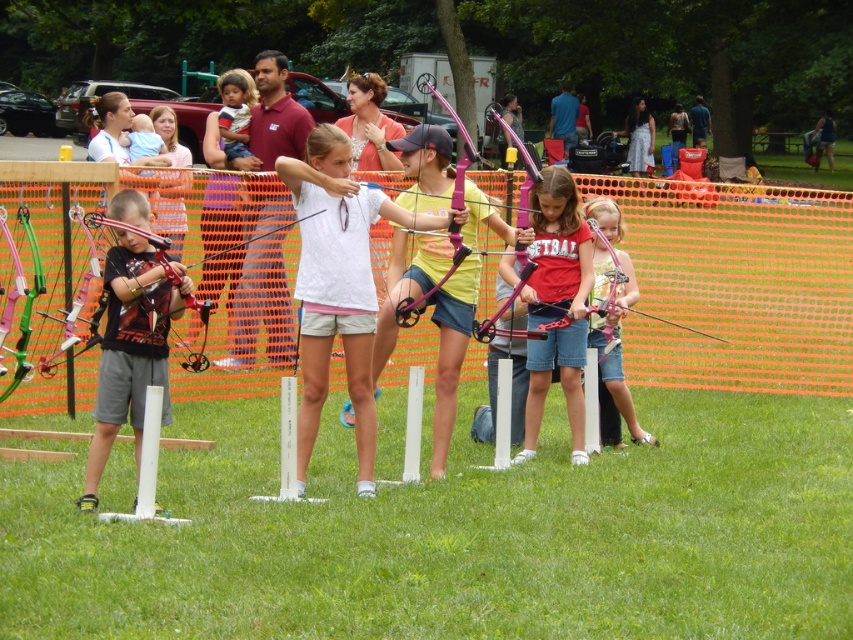
Between point (570, 324) and point (651, 134), which one is positioned behind?

The point (651, 134) is behind.

Which is more to the right, matte red bow at center or matte pink bow at upper right?

Positioned to the right is matte pink bow at upper right.

Which is in front, point (572, 358) or point (636, 112)?

Point (572, 358)

This screenshot has width=853, height=640. Find the location of `matte red bow at center`. matte red bow at center is located at coordinates (556, 305).

Between matte red bow at center and matte pink bow at center, which one appears on the left side from the viewer's perspective?

Positioned to the left is matte red bow at center.

Does matte red bow at center have a greater width compared to matte pink bow at center?

Yes, matte red bow at center is wider than matte pink bow at center.

Describe the element at coordinates (556, 305) in the screenshot. This screenshot has width=853, height=640. I see `matte red bow at center` at that location.

Image resolution: width=853 pixels, height=640 pixels. Find the location of `matte red bow at center`. matte red bow at center is located at coordinates (556, 305).

Does white matte shirt at center come in front of matte pink bow at upper right?

Yes, it is in front of matte pink bow at upper right.

Is white matte shirt at center further to the viewer compared to matte pink bow at upper right?

No.

This screenshot has width=853, height=640. What are the coordinates of `white matte shirt at center` in the screenshot? It's located at (340, 227).